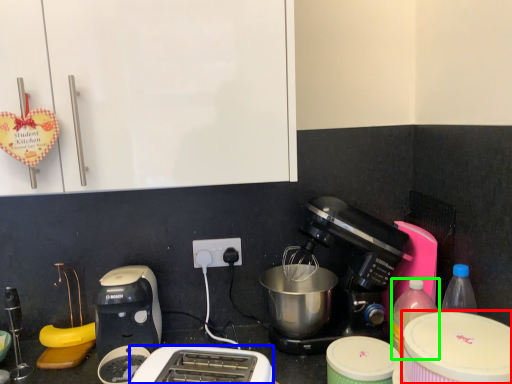
Question: Which object is the closest to the appliance (highlighted by a red box)? Choose among these: toaster (highlighted by a blue box) or bottle (highlighted by a green box).

Choices:
 (A) toaster
 (B) bottle

Answer: (B)